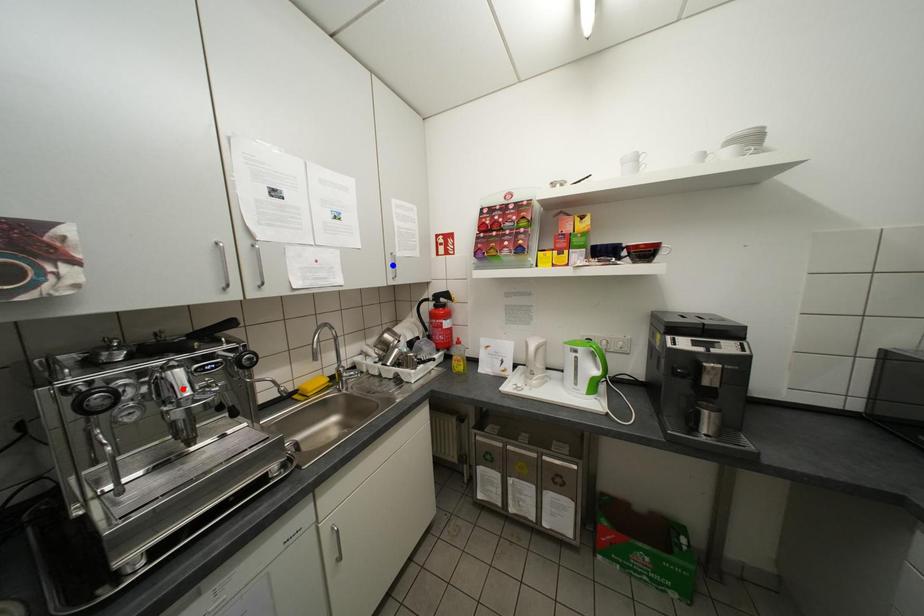
Question: In the image, two points are highlighted. Which point is nearer to the camera? Reply with the corresponding letter.

Choices:
 (A) blue point
 (B) red point

Answer: (B)